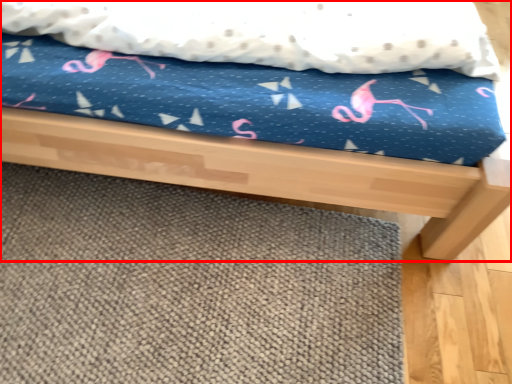
Question: From the image, what is the correct spatial relationship of bed (annotated by the red box) in relation to mat?

Choices:
 (A) right
 (B) left

Answer: (B)